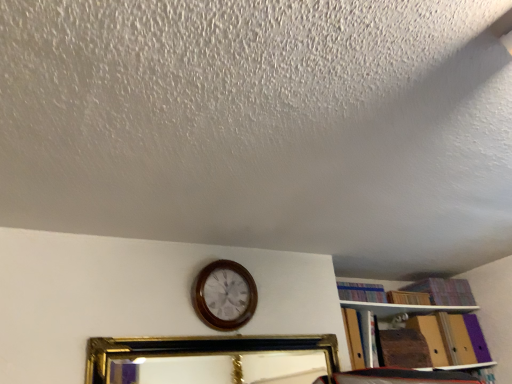
Question: Can you confirm if striped fabric book at upper right is shorter than wooden wall clock at center?

Choices:
 (A) no
 (B) yes

Answer: (B)

Question: Can you confirm if striped fabric book at upper right is taller than wooden wall clock at center?

Choices:
 (A) no
 (B) yes

Answer: (A)

Question: Is striped fabric book at upper right facing towards wooden wall clock at center?

Choices:
 (A) yes
 (B) no

Answer: (B)

Question: Does striped fabric book at upper right have a smaller size compared to wooden wall clock at center?

Choices:
 (A) yes
 (B) no

Answer: (A)

Question: Can you confirm if striped fabric book at upper right is bigger than wooden wall clock at center?

Choices:
 (A) yes
 (B) no

Answer: (B)

Question: Is gold/gilded picture frame at center taller or shorter than wooden wall clock at center?

Choices:
 (A) tall
 (B) short

Answer: (B)

Question: In the image, is gold/gilded picture frame at center on the left side or the right side of wooden wall clock at center?

Choices:
 (A) right
 (B) left

Answer: (A)

Question: Is gold/gilded picture frame at center situated inside wooden wall clock at center or outside?

Choices:
 (A) outside
 (B) inside

Answer: (A)

Question: Considering the positions of gold/gilded picture frame at center and wooden wall clock at center in the image, is gold/gilded picture frame at center wider or thinner than wooden wall clock at center?

Choices:
 (A) thin
 (B) wide

Answer: (B)

Question: Considering the positions of gold/gilded picture frame at center and striped fabric book at upper right in the image, is gold/gilded picture frame at center taller or shorter than striped fabric book at upper right?

Choices:
 (A) tall
 (B) short

Answer: (A)

Question: From a real-world perspective, is gold/gilded picture frame at center positioned above or below striped fabric book at upper right?

Choices:
 (A) above
 (B) below

Answer: (B)

Question: Considering their positions, is gold/gilded picture frame at center located in front of or behind striped fabric book at upper right?

Choices:
 (A) front
 (B) behind

Answer: (A)

Question: Is gold/gilded picture frame at center inside or outside of striped fabric book at upper right?

Choices:
 (A) inside
 (B) outside

Answer: (B)

Question: Choose the correct answer: Is striped fabric book at upper right inside wooden wall clock at center or outside it?

Choices:
 (A) inside
 (B) outside

Answer: (B)

Question: From the image's perspective, relative to wooden wall clock at center, is striped fabric book at upper right above or below?

Choices:
 (A) above
 (B) below

Answer: (B)